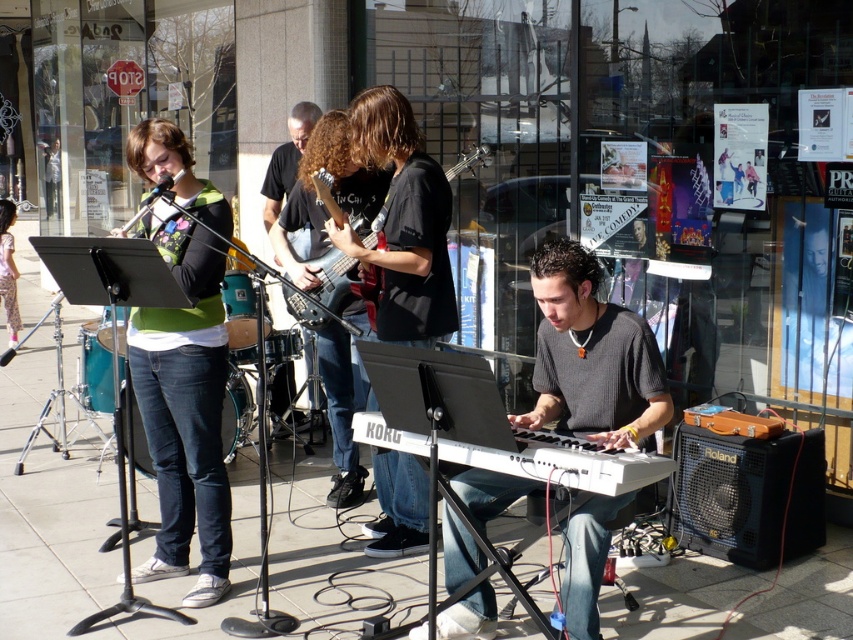
Is gray knitted sweater at center bigger than black fabric guitar at center?

Yes.

The height and width of the screenshot is (640, 853). Describe the element at coordinates (590, 356) in the screenshot. I see `gray knitted sweater at center` at that location.

Measure the distance between gray knitted sweater at center and camera.

gray knitted sweater at center is 3.43 meters from camera.

Locate an element on the screen. The height and width of the screenshot is (640, 853). gray knitted sweater at center is located at coordinates (590, 356).

Is shiny black guitar at center shorter than white plastic keyboard at center?

In fact, shiny black guitar at center may be taller than white plastic keyboard at center.

Can you confirm if shiny black guitar at center is positioned to the left of white plastic keyboard at center?

Correct, you'll find shiny black guitar at center to the left of white plastic keyboard at center.

What do you see at coordinates (332, 193) in the screenshot? This screenshot has height=640, width=853. I see `shiny black guitar at center` at bounding box center [332, 193].

Identify the location of shiny black guitar at center. (332, 193).

Is gray knitted sweater at center to the right of denim jeans at lower left from the viewer's perspective?

Yes, gray knitted sweater at center is to the right of denim jeans at lower left.

Measure the distance between point (643, 436) and camera.

Point (643, 436) is 3.68 meters away from camera.

Who is more forward, (633, 314) or (0, 269)?

Positioned in front is point (633, 314).

Find the location of a particular element. Image resolution: width=853 pixels, height=640 pixels. gray knitted sweater at center is located at coordinates (590, 356).